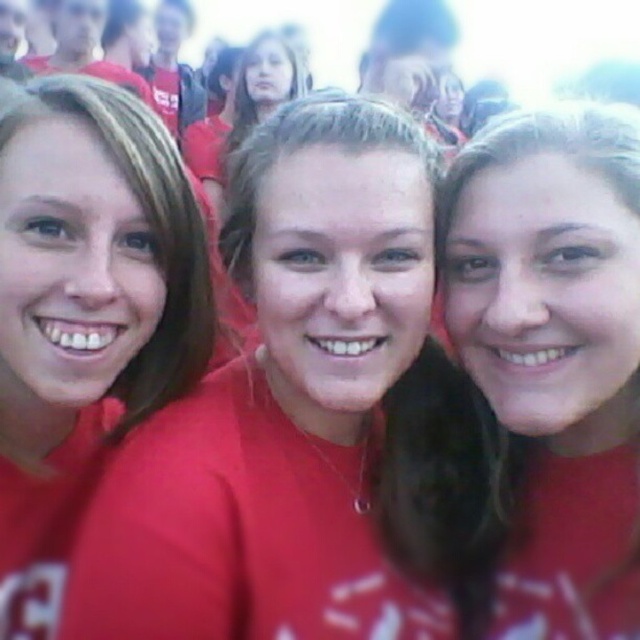
Looking at this image, you are trying to locate the matte red shirt at center in the image. According to the coordinates provided, where exactly is it positioned?

The matte red shirt at center is located at point coordinates (554, 353).

You are a photographer trying to adjust the composition of your photo. You want to ensure that the matte red shirt at center and the matte red shirt at left are both visible in the frame. Based on their heights, which one might you need to position closer to the camera to keep them both in focus?

The matte red shirt at center has a lesser height compared to matte red shirt at left. To keep both in focus, you should position the shorter matte red shirt at center closer to the camera since it is shorter and might be obscured by the taller one otherwise.